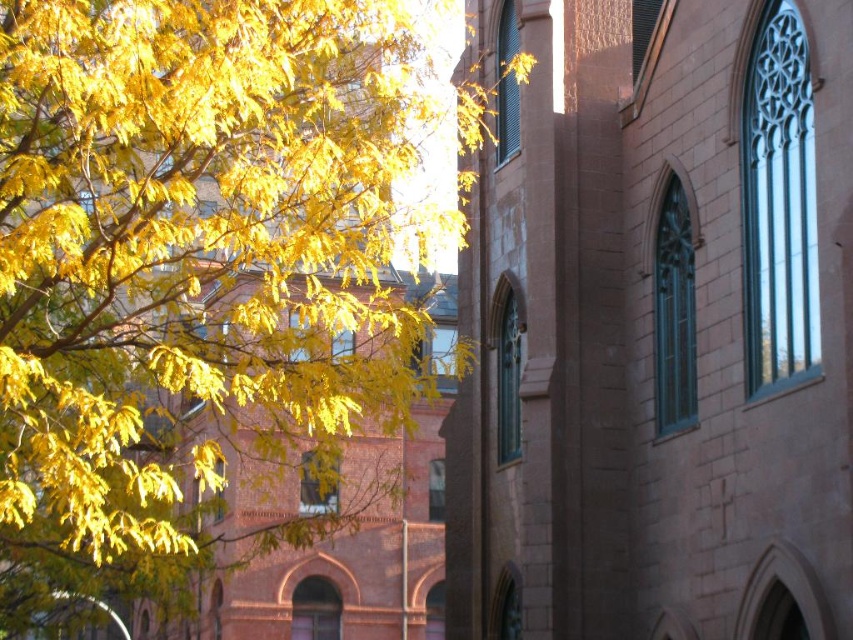
You are an architect analyzing the building facade. Which object between the brown stone tower at center and the yellow leafy branches at left appears narrower from your viewpoint?

The brown stone tower at center appears narrower than the yellow leafy branches at left because it has a lesser width compared to them.

You are standing in front of the historic building and want to take a photo that includes both the brown stone tower at center and the yellow leafy branches at left. Which object should you position closer to the edge of the frame to ensure both fit in the shot?

You should position the brown stone tower at center closer to the edge of the frame because it is smaller in size compared to the yellow leafy branches at left, allowing both to fit within the shot.